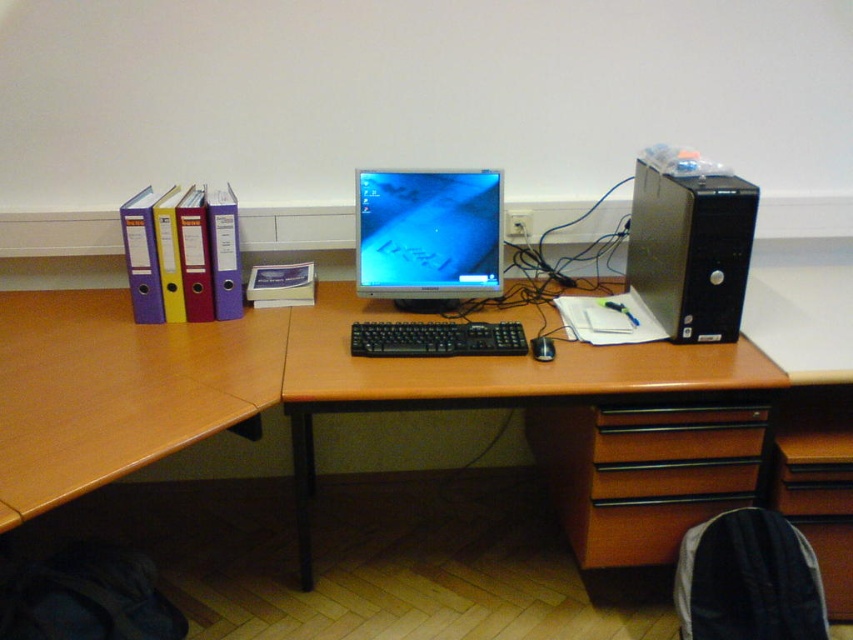
Can you confirm if brown wood computer desk at center is smaller than matte plastic monitor at center?

Incorrect, brown wood computer desk at center is not smaller in size than matte plastic monitor at center.

Is brown wood computer desk at center bigger than matte plastic monitor at center?

Yes, brown wood computer desk at center is bigger than matte plastic monitor at center.

Describe the element at coordinates (483, 378) in the screenshot. This screenshot has height=640, width=853. I see `brown wood computer desk at center` at that location.

At what (x,y) coordinates should I click in order to perform the action: click on brown wood computer desk at center. Please return your answer as a coordinate pair (x, y). Looking at the image, I should click on (483, 378).

Between brown wood computer desk at center and satin black tower at right, which one has less height?

Standing shorter between the two is satin black tower at right.

Does brown wood computer desk at center appear over satin black tower at right?

Incorrect, brown wood computer desk at center is not positioned above satin black tower at right.

The image size is (853, 640). What do you see at coordinates (483, 378) in the screenshot?
I see `brown wood computer desk at center` at bounding box center [483, 378].

Identify the location of brown wood computer desk at center. (483, 378).

Who is taller, wooden desk at left or black plastic keyboard at center?

wooden desk at left is taller.

Which is above, wooden desk at left or black plastic keyboard at center?

Positioned higher is black plastic keyboard at center.

Is point (102, 429) more distant than point (479, 337)?

No, it is not.

I want to click on wooden desk at left, so click(x=115, y=388).